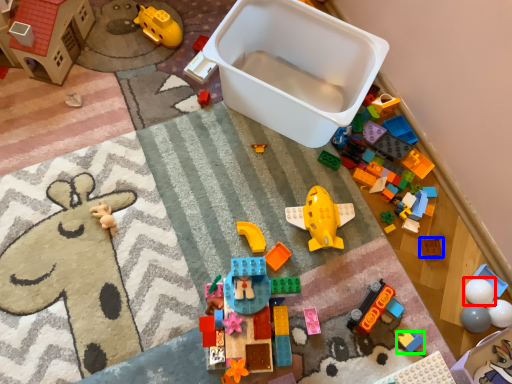
Question: Which object is the closest to the toy (highlighted by a red box)? Choose among these: toy (highlighted by a blue box) or toy (highlighted by a green box).

Choices:
 (A) toy
 (B) toy

Answer: (A)